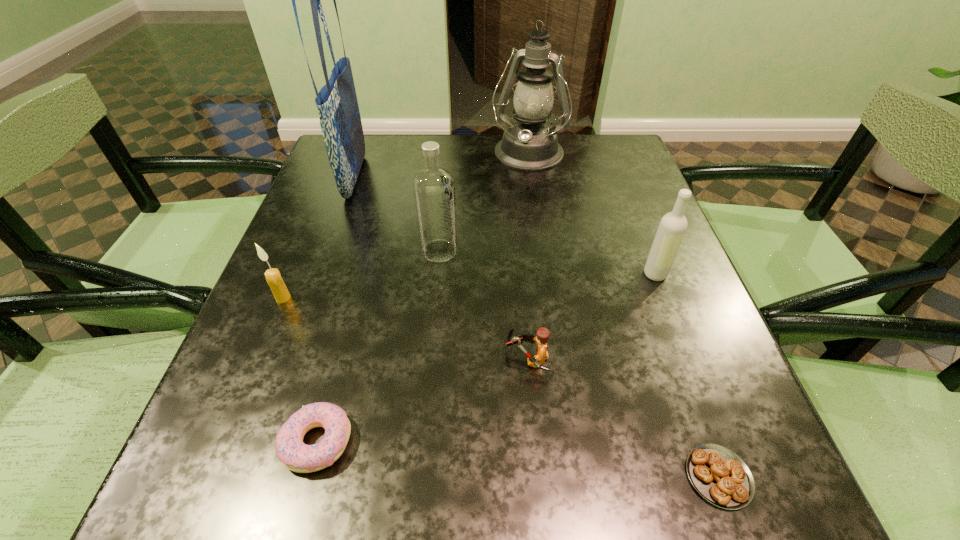
You are a GUI agent. You are given a task and a screenshot of the screen. Output one action in this format:
    pyautogui.click(x=<x>, y=<y>)
    Task: Click on the blank region between the doughnut and the second tallest object
    
    Given the screenshot: What is the action you would take?
    pyautogui.click(x=422, y=299)

Find the location of a particular element. The height and width of the screenshot is (540, 960). object that is the second closest one to the sixth shortest object is located at coordinates (542, 335).

The image size is (960, 540). Identify the location of object that is the third closest to the shorter vodka. (530, 144).

I want to click on free space that satisfies the following two spatial constraints: 1. on the front side of the second tallest object; 2. on the front label of the sixth shortest object, so (x=541, y=251).

The image size is (960, 540). What are the coordinates of `vacant position in the image that satisfies the following two spatial constraints: 1. on the front side of the fourth shortest object; 2. on the right side of the seventh tallest object` in the screenshot? It's located at click(224, 441).

Where is `vacant area in the image that satisfies the following two spatial constraints: 1. on the back side of the fifth farthest object; 2. on the left side of the nearer vodka`? The image size is (960, 540). vacant area in the image that satisfies the following two spatial constraints: 1. on the back side of the fifth farthest object; 2. on the left side of the nearer vodka is located at coordinates (293, 274).